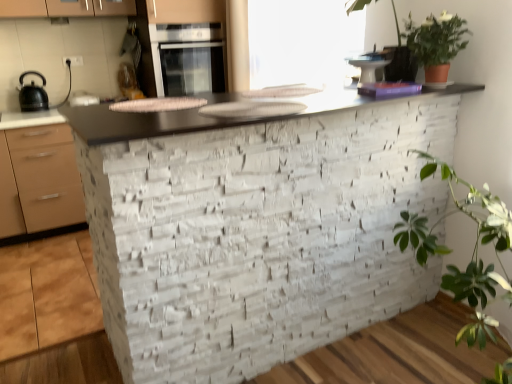
Question: From the image's perspective, is smooth stone countertop at center above satin silver oven at upper center?

Choices:
 (A) no
 (B) yes

Answer: (A)

Question: Does smooth stone countertop at center have a greater height compared to satin silver oven at upper center?

Choices:
 (A) no
 (B) yes

Answer: (B)

Question: Does smooth stone countertop at center come in front of satin silver oven at upper center?

Choices:
 (A) yes
 (B) no

Answer: (A)

Question: Does smooth stone countertop at center appear on the right side of satin silver oven at upper center?

Choices:
 (A) yes
 (B) no

Answer: (A)

Question: Is smooth stone countertop at center facing away from satin silver oven at upper center?

Choices:
 (A) no
 (B) yes

Answer: (A)

Question: Choose the correct answer: Is green leafy plant at upper right inside green matte plant at upper right or outside it?

Choices:
 (A) outside
 (B) inside

Answer: (A)

Question: In terms of height, does green leafy plant at upper right look taller or shorter compared to green matte plant at upper right?

Choices:
 (A) tall
 (B) short

Answer: (A)

Question: Based on their positions, is green leafy plant at upper right located to the left or right of green matte plant at upper right?

Choices:
 (A) left
 (B) right

Answer: (A)

Question: In terms of size, does green leafy plant at upper right appear bigger or smaller than green matte plant at upper right?

Choices:
 (A) big
 (B) small

Answer: (A)

Question: Considering their positions, is transparent plastic window screen at upper center located in front of or behind matte black kettle at left?

Choices:
 (A) behind
 (B) front

Answer: (B)

Question: Considering the positions of transparent plastic window screen at upper center and matte black kettle at left in the image, is transparent plastic window screen at upper center bigger or smaller than matte black kettle at left?

Choices:
 (A) big
 (B) small

Answer: (A)

Question: From a real-world perspective, is transparent plastic window screen at upper center positioned above or below matte black kettle at left?

Choices:
 (A) below
 (B) above

Answer: (B)

Question: Visually, is transparent plastic window screen at upper center positioned to the left or to the right of matte black kettle at left?

Choices:
 (A) left
 (B) right

Answer: (B)

Question: Visually, is satin silver oven at upper center positioned to the left or to the right of transparent plastic window screen at upper center?

Choices:
 (A) left
 (B) right

Answer: (A)

Question: In terms of height, does satin silver oven at upper center look taller or shorter compared to transparent plastic window screen at upper center?

Choices:
 (A) short
 (B) tall

Answer: (A)